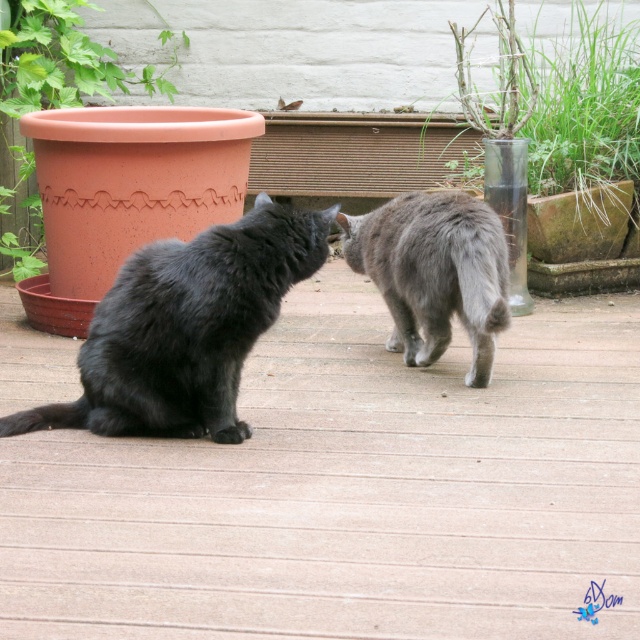
You are a photographer setting up a wide shot of the scene. You need to ensure both the gray fluffy cat at center and the terracotta clay pot at left are fully visible in the frame. Given their sizes, which object might require you to adjust your camera angle to include it entirely?

The terracotta clay pot at left requires adjusting the camera angle because the gray fluffy cat at center occupies less space, meaning the pot is larger and might be cut off if not properly framed.

You are a photographer trying to capture a closeup of the gray fluffy cat at center. You notice the terracotta clay pot at left is blocking your view. Can you move the pot to the side to get a better shot?

The gray fluffy cat at center is closer to the viewer than the terracotta clay pot at left, so moving the pot to the side would not help because the cat is already in front of the pot. The pot is behind the cat and not blocking the view.